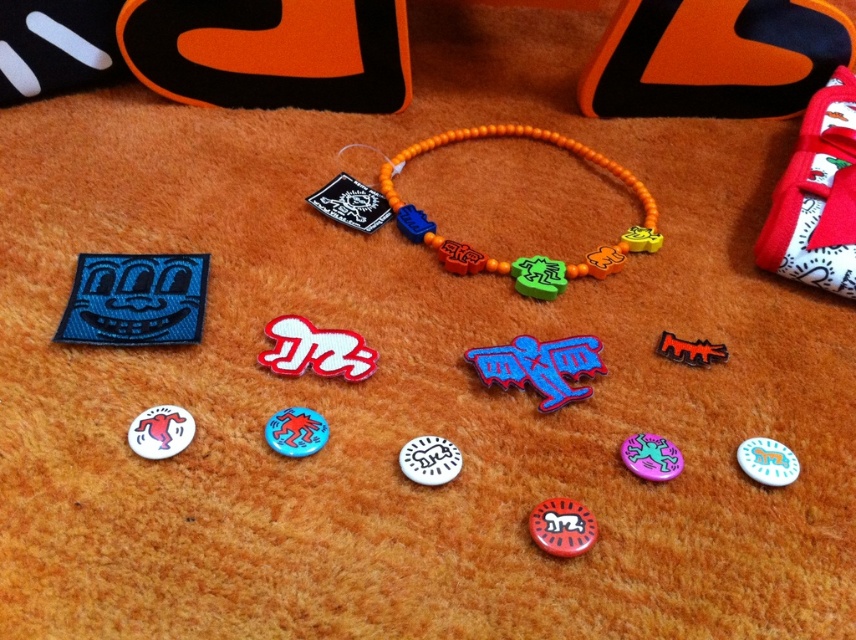
Question: Estimate the real-world distances between objects in this image. Which object is closer to the pink glossy button at center?

Choices:
 (A) red glossy magnet at center
 (B) white matte badge at center
 (C) orange wooden beads at center
 (D) white glossy badge at lower right

Answer: (D)

Question: Which object appears closest to the camera in this image?

Choices:
 (A) red glossy magnet at center
 (B) velvet fabric toy at upper right

Answer: (A)

Question: From the image, what is the correct spatial relationship of blue matte badge at upper left in relation to orange wooden beads at center?

Choices:
 (A) above
 (B) below

Answer: (B)

Question: Which of the following is the farthest from the observer?

Choices:
 (A) (486, 365)
 (B) (343, 195)
 (C) (619, 241)
 (D) (817, 230)

Answer: (B)

Question: Does blue matte badge at upper left come in front of black plastic dinosaur at center?

Choices:
 (A) no
 (B) yes

Answer: (B)

Question: Can you confirm if blue matte badge at upper left is positioned above blue glossy pin at center?

Choices:
 (A) yes
 (B) no

Answer: (A)